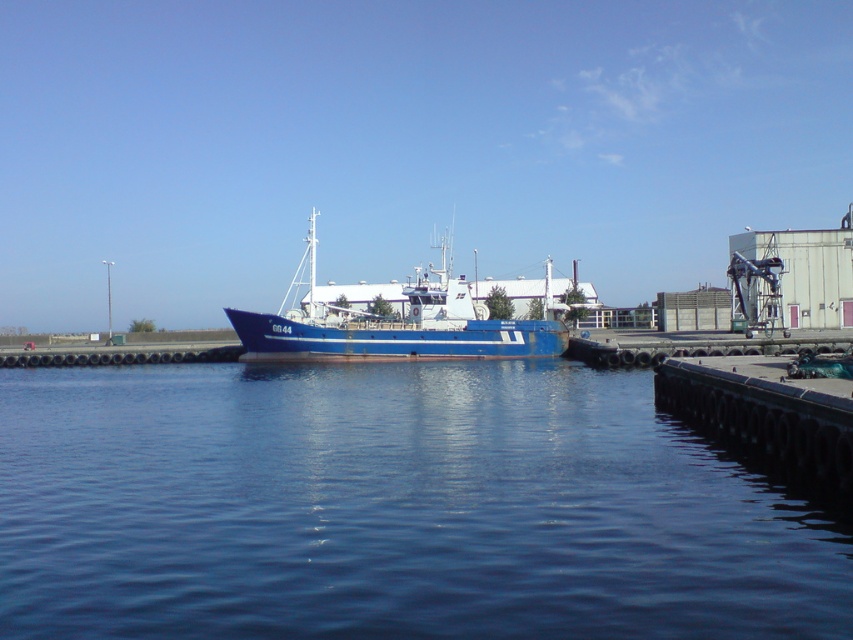
You are standing at the dock in the harbor scene. You see two points marked on the water surface. The first point is at coordinate point (346, 387) and the second point is at coordinate point (436, 324). If you want to move from the first point to the second point, which direction should you move relative to the dock? Please answer with either left, right, forward, or backward.

Since point (346, 387) is in front of point (436, 324), you should move backward towards the dock to reach the second point from the first point.

You are a sailor trying to anchor your boat. You see the blue water at center and the blue matte boat at center. Which object is smaller in size?

The blue water at center is smaller in size compared to the blue matte boat at center according to the description.

Looking at this image, you are standing on the dock on the right side of the harbor. You see a point marked at coordinates (392, 508). Based on the scene description, what is the location of this point relative to the blue fishing vessel?

The point at coordinates (392, 508) corresponds to blue water at center, which is located in the middle of the harbor, directly in front of the blue fishing vessel that is moored at the dock on the right side.